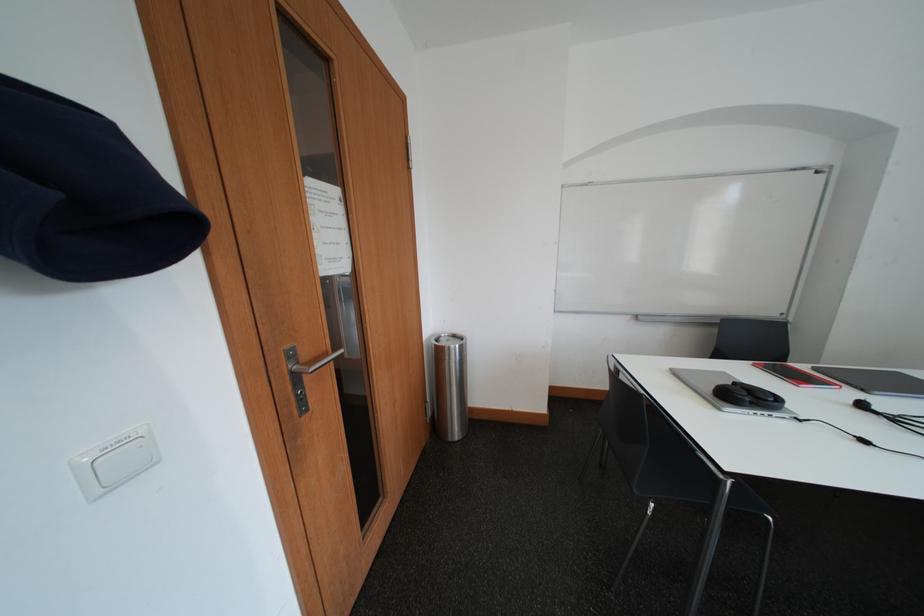
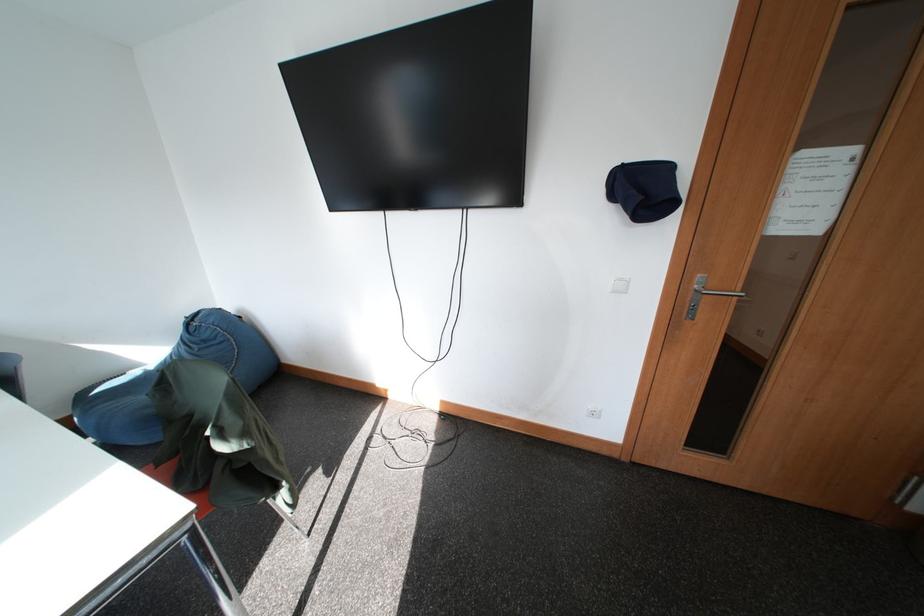
From the picture: First-person continuous shooting, in which direction is the camera rotating?

The camera rotated toward left-down.